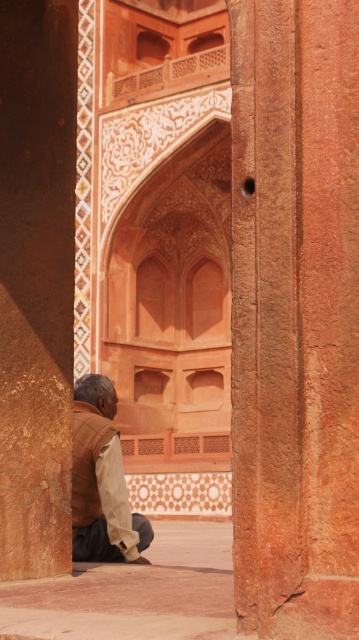
Question: Which of the following is the farthest from the observer?

Choices:
 (A) (338, 152)
 (B) (141, 515)

Answer: (B)

Question: Among these objects, which one is farthest from the camera?

Choices:
 (A) brown cotton shirt at lower left
 (B) rustic stone pillar at center

Answer: (A)

Question: Is rustic stone pillar at center smaller than brown cotton shirt at lower left?

Choices:
 (A) yes
 (B) no

Answer: (A)

Question: Observing the image, what is the correct spatial positioning of rustic stone pillar at center in reference to brown cotton shirt at lower left?

Choices:
 (A) left
 (B) right

Answer: (B)

Question: Which object appears closest to the camera in this image?

Choices:
 (A) rustic stone pillar at center
 (B) brown cotton shirt at lower left

Answer: (A)

Question: Is rustic stone pillar at center above brown cotton shirt at lower left?

Choices:
 (A) no
 (B) yes

Answer: (B)